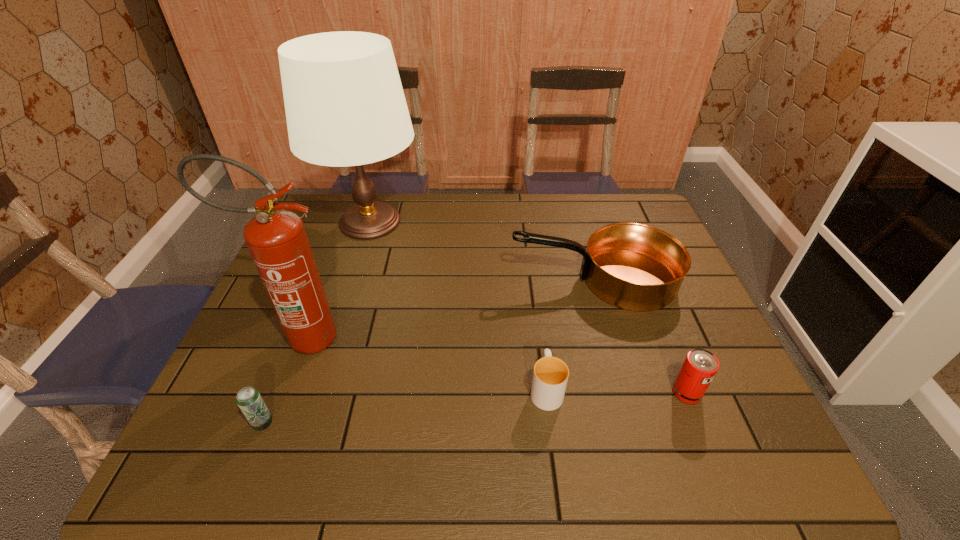
You are a GUI agent. You are given a task and a screenshot of the screen. Output one action in this format:
    pyautogui.click(x=<x>, y=<y>)
    Task: Click on the object that is the closest to the cup
    The image size is (960, 540).
    Given the screenshot: What is the action you would take?
    pyautogui.click(x=632, y=266)

Locate which object ranks third in proximity to the can. Please provide its 2D coordinates. Your answer should be formatted as a tuple, i.e. [(x, y)], where the tuple contains the x and y coordinates of a point satisfying the conditions above.

[(277, 240)]

I want to click on free point that satisfies the following two spatial constraints: 1. on the front side of the lamp; 2. from the nozzle of the fire extinguisher, so click(x=332, y=338).

Find the location of `blank area in the image that satisfies the following two spatial constraints: 1. from the nozzle of the can; 2. on the right side of the fire extinguisher`. blank area in the image that satisfies the following two spatial constraints: 1. from the nozzle of the can; 2. on the right side of the fire extinguisher is located at coordinates (280, 393).

Find the location of a particular element. This screenshot has height=540, width=960. vacant space that satisfies the following two spatial constraints: 1. with the handle on the side of the cup; 2. from the nozzle of the fourth nearest object is located at coordinates (540, 338).

This screenshot has width=960, height=540. I want to click on vacant region that satisfies the following two spatial constraints: 1. on the handle side of the can; 2. on the right side of the third tallest object, so click(626, 393).

The height and width of the screenshot is (540, 960). I want to click on free point that satisfies the following two spatial constraints: 1. from the nozzle of the fourth nearest object; 2. on the right side of the can, so click(280, 393).